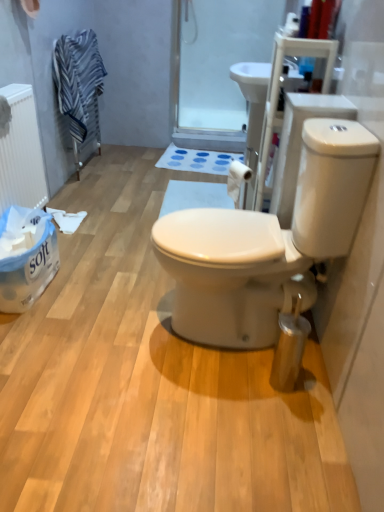
Image resolution: width=384 pixels, height=512 pixels. What do you see at coordinates (79, 84) in the screenshot? I see `striped fabric towel at upper left` at bounding box center [79, 84].

Identify the location of blue fabric bath mat at center. (197, 160).

Image resolution: width=384 pixels, height=512 pixels. I want to click on white matte toilet paper at center, so click(x=237, y=179).

This screenshot has height=512, width=384. Identify the location of striped fabric towel at upper left. (79, 84).

Is transparent plastic screen door at upper center spatially inside striped fabric towel at upper left, or outside of it?

transparent plastic screen door at upper center exists outside the volume of striped fabric towel at upper left.

Is the position of transparent plastic screen door at upper center more distant than that of striped fabric towel at upper left?

Yes, transparent plastic screen door at upper center is behind striped fabric towel at upper left.

From the picture: From a real-world perspective, between transparent plastic screen door at upper center and striped fabric towel at upper left, who is vertically lower?

In real-world perspective, striped fabric towel at upper left is lower.

Does transparent plastic screen door at upper center have a greater width compared to striped fabric towel at upper left?

No.

Based on the photo, from the image's perspective, is white matte toilet paper at center beneath blue fabric bath mat at center?

Yes.

From the picture: How different are the orientations of white matte toilet paper at center and blue fabric bath mat at center in degrees?

The facing directions of white matte toilet paper at center and blue fabric bath mat at center are 59.9 degrees apart.

Visually, is white matte toilet paper at center positioned to the left or to the right of blue fabric bath mat at center?

white matte toilet paper at center is to the right of blue fabric bath mat at center.

Considering the sizes of objects white matte toilet paper at center and blue fabric bath mat at center in the image provided, who is wider, white matte toilet paper at center or blue fabric bath mat at center?

Wider between the two is blue fabric bath mat at center.

Can you see white paper towel at lower left touching transparent plastic screen door at upper center?

white paper towel at lower left is not next to transparent plastic screen door at upper center, and they're not touching.

Considering the relative sizes of white paper towel at lower left and transparent plastic screen door at upper center in the image provided, is white paper towel at lower left thinner than transparent plastic screen door at upper center?

Incorrect, the width of white paper towel at lower left is not less than that of transparent plastic screen door at upper center.

Which of these two, white paper towel at lower left or transparent plastic screen door at upper center, stands shorter?

With less height is white paper towel at lower left.

From a real-world perspective, is white paper towel at lower left located higher than transparent plastic screen door at upper center?

No.

Is striped fabric towel at upper left beside blue fabric bath mat at center?

striped fabric towel at upper left and blue fabric bath mat at center are clearly separated.

Measure the distance from striped fabric towel at upper left to blue fabric bath mat at center.

striped fabric towel at upper left is 32.39 inches from blue fabric bath mat at center.

From the image's perspective, is striped fabric towel at upper left located above or below blue fabric bath mat at center?

striped fabric towel at upper left is situated higher than blue fabric bath mat at center in the image.

Is striped fabric towel at upper left inside or outside of blue fabric bath mat at center?

striped fabric towel at upper left is not inside blue fabric bath mat at center, it's outside.

Would you say transparent plastic screen door at upper center is outside white paper towel at lower left?

transparent plastic screen door at upper center is positioned outside white paper towel at lower left.

Between transparent plastic screen door at upper center and white paper towel at lower left, which one has less height?

Standing shorter between the two is white paper towel at lower left.

From a real-world perspective, is transparent plastic screen door at upper center above or below white paper towel at lower left?

In terms of real-world spatial position, transparent plastic screen door at upper center is above white paper towel at lower left.

Is white matte radiator at left looking in the opposite direction of white glossy toilet at center?

No, white glossy toilet at center is not at the back of white matte radiator at left.

Is the position of white matte radiator at left less distant than that of white glossy toilet at center?

No, white matte radiator at left is further to the viewer.

Which of these two, white matte radiator at left or white glossy toilet at center, is smaller?

white matte radiator at left is smaller.

Is white matte radiator at left far from white glossy toilet at center?

Indeed, white matte radiator at left is not near white glossy toilet at center.

Considering the sizes of objects white matte toilet paper at center and transparent plastic screen door at upper center in the image provided, who is bigger, white matte toilet paper at center or transparent plastic screen door at upper center?

Bigger between the two is transparent plastic screen door at upper center.

Which is more to the left, white matte toilet paper at center or transparent plastic screen door at upper center?

From the viewer's perspective, white matte toilet paper at center appears more on the left side.

Which is behind, white matte toilet paper at center or transparent plastic screen door at upper center?

transparent plastic screen door at upper center is further away from the camera.

Where is `screen door on the right of white matte toilet paper at center`? The height and width of the screenshot is (512, 384). screen door on the right of white matte toilet paper at center is located at coordinates (218, 68).

The image size is (384, 512). What are the coordinates of `screen door that appears above the striped fabric towel at upper left (from a real-world perspective)` in the screenshot? It's located at (218, 68).

The image size is (384, 512). What are the coordinates of `toilet paper that is in front of the blue fabric bath mat at center` in the screenshot? It's located at (237, 179).

Estimate the real-world distances between objects in this image. Which object is further from striped fabric towel at upper left, transparent plastic screen door at upper center or white matte toilet paper at center?

white matte toilet paper at center.

Based on their spatial positions, is striped fabric towel at upper left or white glossy toilet at center further from white matte toilet paper at center?

The object further to white matte toilet paper at center is striped fabric towel at upper left.

From the image, which object appears to be farther from transparent plastic screen door at upper center, white matte toilet paper at center or white paper towel at lower left?

Based on the image, white paper towel at lower left appears to be further to transparent plastic screen door at upper center.

Which object lies nearer to the anchor point striped fabric towel at upper left, white glossy toilet at center or blue fabric bath mat at center?

Among the two, blue fabric bath mat at center is located nearer to striped fabric towel at upper left.

Considering their positions, is white matte radiator at left positioned closer to blue fabric bath mat at center than transparent plastic screen door at upper center?

The object closer to blue fabric bath mat at center is transparent plastic screen door at upper center.

When comparing their distances from transparent plastic screen door at upper center, does blue fabric bath mat at center or white matte radiator at left seem further?

white matte radiator at left lies further to transparent plastic screen door at upper center than the other object.

Based on their spatial positions, is transparent plastic screen door at upper center or blue fabric bath mat at center closer to white matte radiator at left?

Based on the image, blue fabric bath mat at center appears to be nearer to white matte radiator at left.

Looking at this image, when comparing their distances from white matte toilet paper at center, does white paper towel at lower left or striped fabric towel at upper left seem further?

Among the two, striped fabric towel at upper left is located further to white matte toilet paper at center.

The width and height of the screenshot is (384, 512). Find the location of `radiator between white glossy toilet at center and blue fabric bath mat at center in the front-back direction`. radiator between white glossy toilet at center and blue fabric bath mat at center in the front-back direction is located at coordinates (20, 150).

You are a GUI agent. You are given a task and a screenshot of the screen. Output one action in this format:
    pyautogui.click(x=<x>, y=<y>)
    Task: Click on the cardboard box between white matte radiator at left and white matte toilet paper at center from left to right
    This screenshot has height=512, width=384.
    Given the screenshot: What is the action you would take?
    pyautogui.click(x=26, y=257)

In order to click on toilet between white paper towel at lower left and white matte toilet paper at center in this screenshot , I will do `click(267, 243)`.

You are a GUI agent. You are given a task and a screenshot of the screen. Output one action in this format:
    pyautogui.click(x=<x>, y=<y>)
    Task: Click on the radiator located between white glossy toilet at center and transparent plastic screen door at upper center in the depth direction
    This screenshot has height=512, width=384.
    Given the screenshot: What is the action you would take?
    pyautogui.click(x=20, y=150)